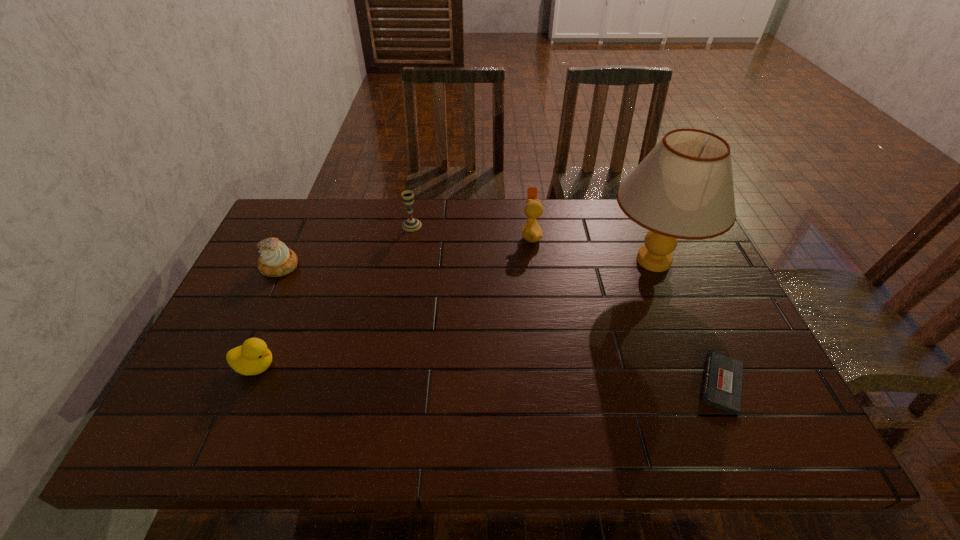
Where is `free point between the chalice and the pastry`? free point between the chalice and the pastry is located at coordinates (346, 246).

At what (x,y) coordinates should I click in order to perform the action: click on unoccupied position between the tallest object and the third object from left to right. Please return your answer as a coordinate pair (x, y). Looking at the image, I should click on (533, 243).

At what (x,y) coordinates should I click in order to perform the action: click on vacant point located between the third object from left to right and the videotape. Please return your answer as a coordinate pair (x, y). Image resolution: width=960 pixels, height=540 pixels. Looking at the image, I should click on (566, 304).

This screenshot has width=960, height=540. In order to click on vacant space that's between the shorter duck and the third object from right to left in this screenshot , I will do `click(394, 301)`.

This screenshot has height=540, width=960. Identify the location of vacant point located between the tallest object and the videotape. (687, 322).

You are a GUI agent. You are given a task and a screenshot of the screen. Output one action in this format:
    pyautogui.click(x=<x>, y=<y>)
    Task: Click on the unoccupied position between the shortest object and the tallest object
    This screenshot has width=960, height=540.
    Given the screenshot: What is the action you would take?
    pyautogui.click(x=687, y=322)

You are a GUI agent. You are given a task and a screenshot of the screen. Output one action in this format:
    pyautogui.click(x=<x>, y=<y>)
    Task: Click on the free space between the pastry and the chalice
    This screenshot has height=540, width=960.
    Given the screenshot: What is the action you would take?
    pyautogui.click(x=346, y=246)

Identify the location of free space between the shortest object and the chalice. This screenshot has width=960, height=540. (566, 304).

Identify the location of free space between the pastry and the chalice. The height and width of the screenshot is (540, 960). (346, 246).

Locate which object is the second closest to the left duck. Please provide its 2D coordinates. Your answer should be formatted as a tuple, i.e. [(x, y)], where the tuple contains the x and y coordinates of a point satisfying the conditions above.

[(411, 224)]